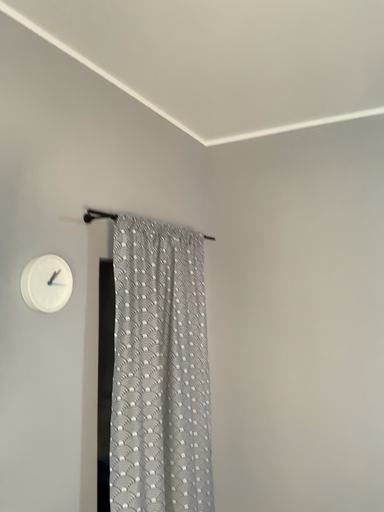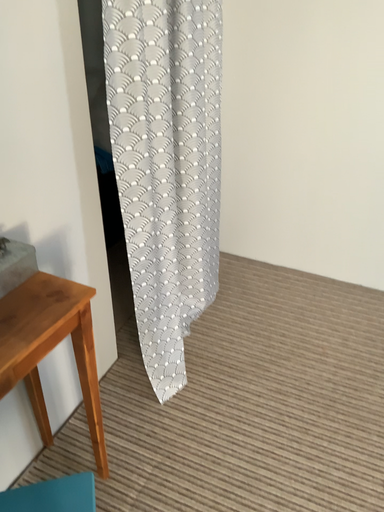
Question: How did the camera likely rotate when shooting the video?

Choices:
 (A) rotated downward
 (B) rotated upward

Answer: (A)